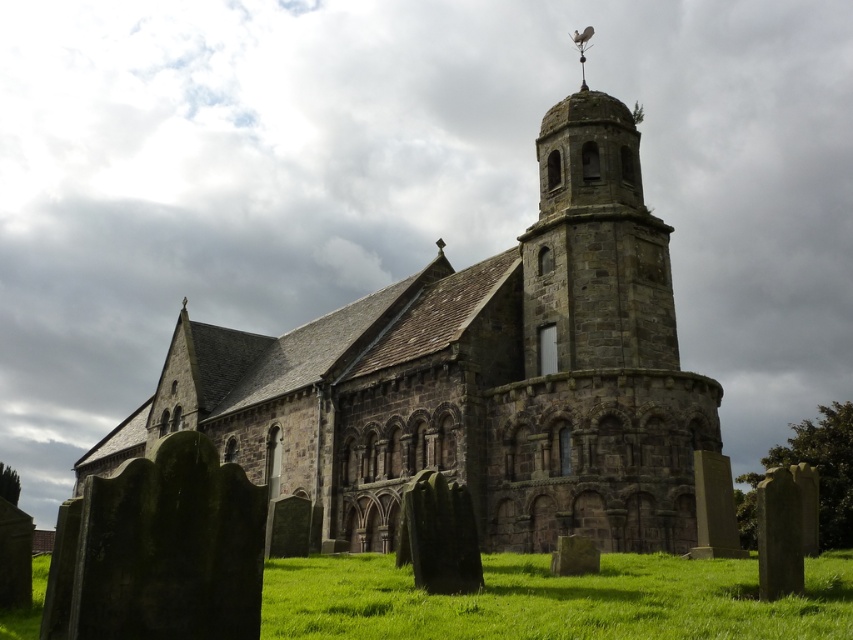
Is brown stone church at center smaller than green grass at lower center?

Actually, brown stone church at center might be larger than green grass at lower center.

Can you confirm if brown stone church at center is positioned to the left of green grass at lower center?

Correct, you'll find brown stone church at center to the left of green grass at lower center.

This screenshot has height=640, width=853. I want to click on brown stone church at center, so click(x=474, y=376).